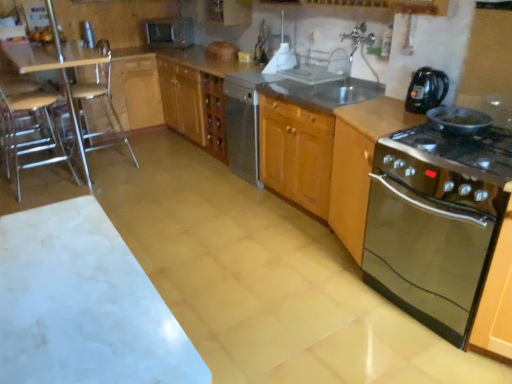
Image resolution: width=512 pixels, height=384 pixels. Find the location of `free space above stainless steel oven at right, positioned as the 2th cabinetry in front-to-back order (from a real-world perspective)`. free space above stainless steel oven at right, positioned as the 2th cabinetry in front-to-back order (from a real-world perspective) is located at coordinates (386, 108).